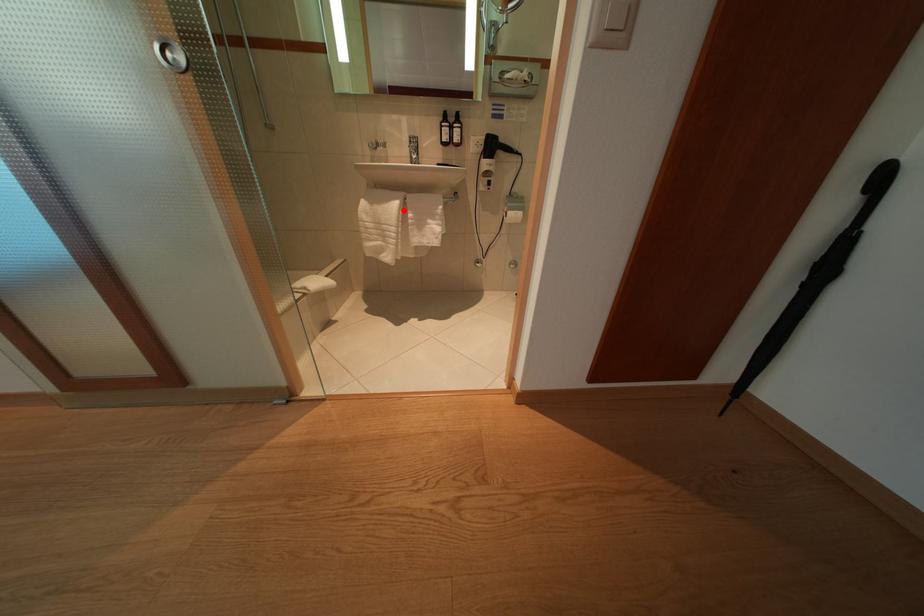
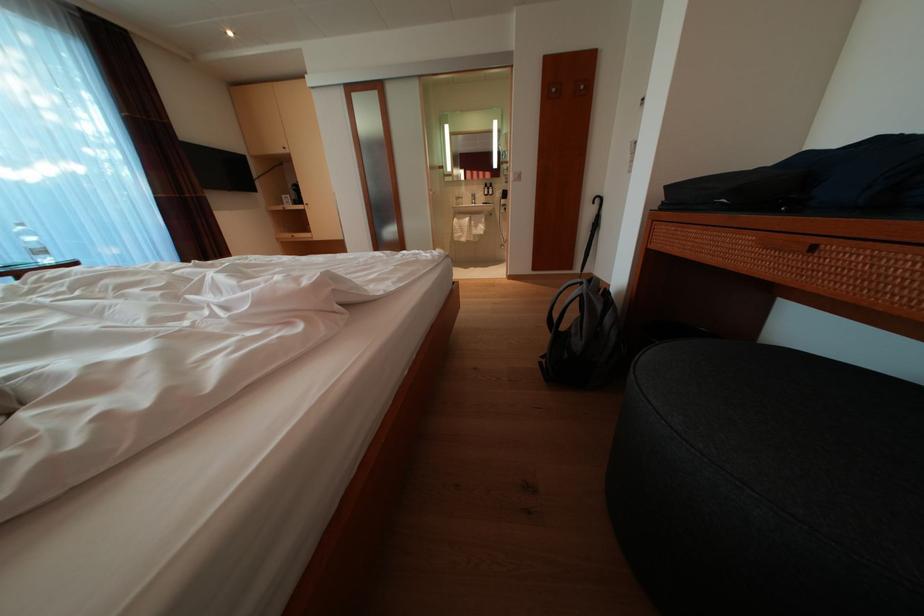
Question: I am providing you with two images of the same scene from different viewpoints. Image1 has a red point marked. In image2, the corresponding 3D location appears at what relative position? Reply with the corresponding letter.

Choices:
 (A) Closer
 (B) Farther

Answer: (A)